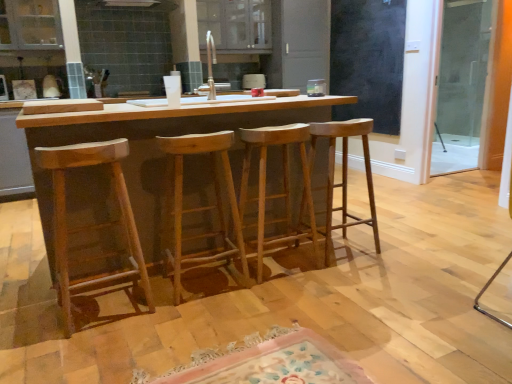
Question: Based on their positions, is natural wood stool at center, which is the third stool from right to left, located to the left or right of black matte screen door at upper right, which is the second screen door from right to left?

Choices:
 (A) right
 (B) left

Answer: (B)

Question: Is point (232, 193) closer or farther from the camera than point (337, 49)?

Choices:
 (A) farther
 (B) closer

Answer: (B)

Question: Which is farther from the natural wood stool at center, placed as the 2th stool when sorted from left to right?

Choices:
 (A) natural wood stool at center, placed as the fourth stool when sorted from left to right
 (B) transparent glass screen door at right, marked as the second screen door in a left-to-right arrangement
 (C) natural wood stool at left, the 1th stool in the left-to-right sequence
 (D) natural wood table at center
 (E) natural wood stool at center, arranged as the third stool when viewed from the left

Answer: (B)

Question: Considering the real-world distances, which object is closest to the natural wood stool at left, the 1th stool in the left-to-right sequence?

Choices:
 (A) black matte screen door at upper right, which is the second screen door from right to left
 (B) natural wood table at center
 (C) natural wood stool at center, which is the second stool from right to left
 (D) natural wood stool at center, placed as the 2th stool when sorted from left to right
 (E) transparent glass screen door at right, the 1th screen door in the right-to-left sequence

Answer: (B)